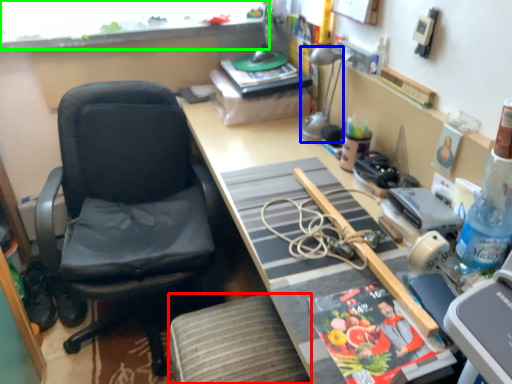
Question: Which object is the farthest from stool (highlighted by a red box)? Choose among these: lamp (highlighted by a blue box) or window screen (highlighted by a green box).

Choices:
 (A) lamp
 (B) window screen

Answer: (B)